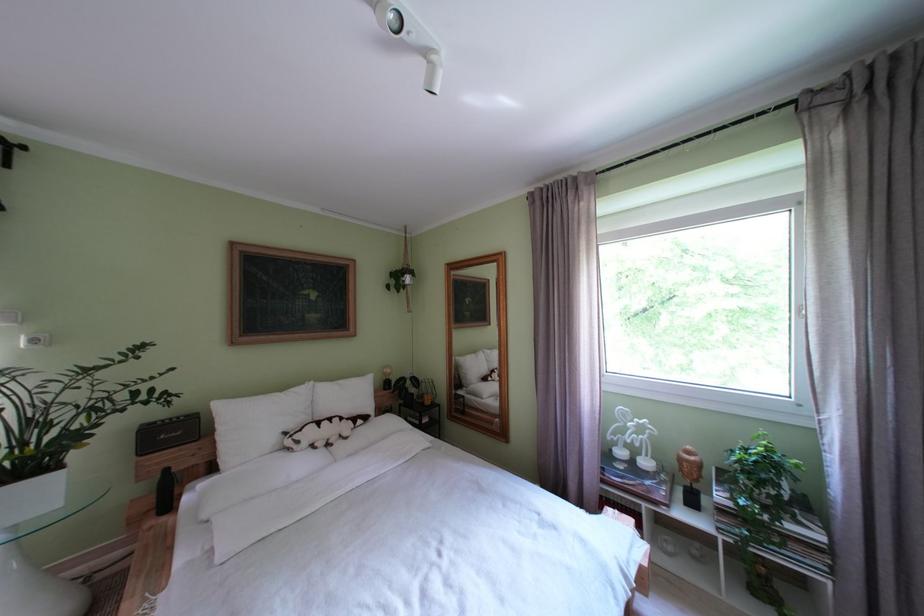
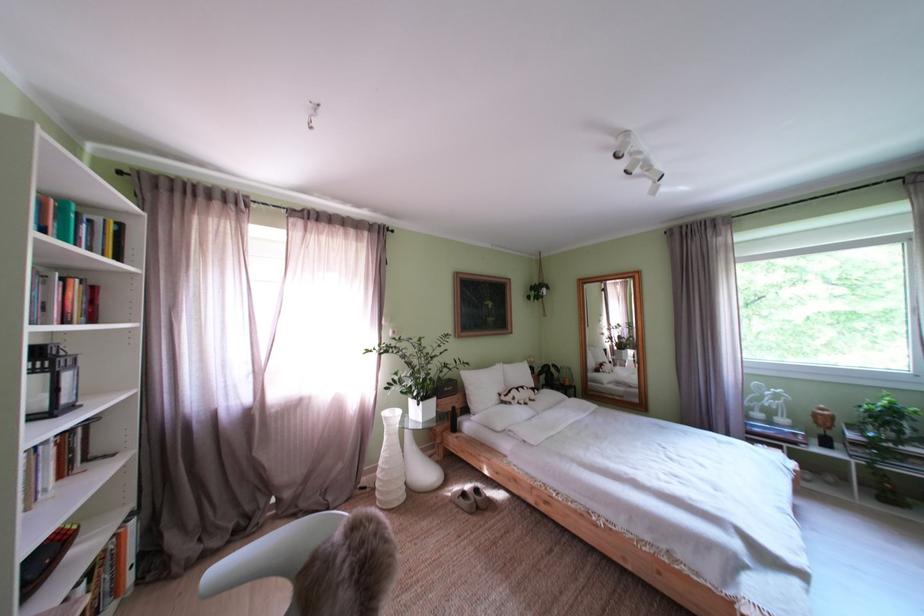
Locate, in the second image, the point that corresponds to (357,440) in the first image.

(543, 403)